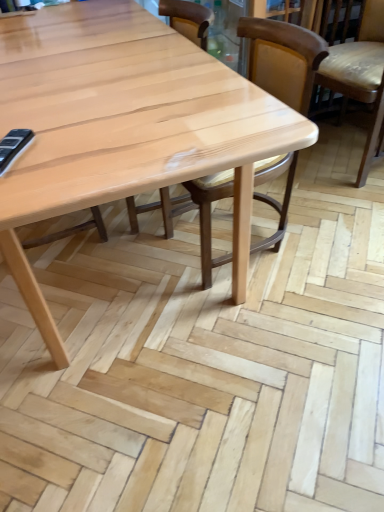
Describe the element at coordinates (361, 76) in the screenshot. Image resolution: width=384 pixels, height=512 pixels. I see `light brown leather chair at right, arranged as the first chair when viewed from the right` at that location.

Locate an element on the screen. wooden chair at center, placed as the second chair when sorted from right to left is located at coordinates (283, 59).

This screenshot has width=384, height=512. What do you see at coordinates (283, 59) in the screenshot?
I see `wooden chair at center, placed as the second chair when sorted from right to left` at bounding box center [283, 59].

At what (x,y) coordinates should I click in order to perform the action: click on light brown leather chair at right, arranged as the first chair when viewed from the right. Please return your answer as a coordinate pair (x, y). Looking at the image, I should click on (361, 76).

At what (x,y) coordinates should I click in order to perform the action: click on chair to the right of wooden chair at center, placed as the second chair when sorted from right to left. Please return your answer as a coordinate pair (x, y). Image resolution: width=384 pixels, height=512 pixels. Looking at the image, I should click on (361, 76).

Considering the sizes of light brown leather chair at right, which is the 3th chair in left-to-right order, and wooden chair at center, placed as the second chair when sorted from right to left, in the image, is light brown leather chair at right, which is the 3th chair in left-to-right order, bigger or smaller than wooden chair at center, placed as the second chair when sorted from right to left,?

light brown leather chair at right, which is the 3th chair in left-to-right order, is bigger than wooden chair at center, placed as the second chair when sorted from right to left.

Which is in front, point (379, 124) or point (293, 57)?

The point (293, 57) is in front.

Can you confirm if natural wood chair at center, which is the first chair in left-to-right order, is shorter than light brown leather chair at right, arranged as the first chair when viewed from the right?

In fact, natural wood chair at center, which is the first chair in left-to-right order, may be taller than light brown leather chair at right, arranged as the first chair when viewed from the right.

How much distance is there between natural wood chair at center, which is the first chair in left-to-right order, and light brown leather chair at right, which is the 3th chair in left-to-right order?

natural wood chair at center, which is the first chair in left-to-right order, is 38.22 inches from light brown leather chair at right, which is the 3th chair in left-to-right order.

Locate an element on the screen. The width and height of the screenshot is (384, 512). chair that is the 1st one when counting forward from the light brown leather chair at right, arranged as the first chair when viewed from the right is located at coordinates (188, 19).

Considering the sizes of objects natural wood chair at center, which is the first chair in left-to-right order, and light brown leather chair at right, arranged as the first chair when viewed from the right, in the image provided, who is wider, natural wood chair at center, which is the first chair in left-to-right order, or light brown leather chair at right, arranged as the first chair when viewed from the right,?

Wider between the two is light brown leather chair at right, arranged as the first chair when viewed from the right.

Considering the sizes of objects natural wood chair at center, which is the 3th chair in right-to-left order, and wooden chair at center, placed as the second chair when sorted from right to left, in the image provided, who is shorter, natural wood chair at center, which is the 3th chair in right-to-left order, or wooden chair at center, placed as the second chair when sorted from right to left,?

Standing shorter between the two is wooden chair at center, placed as the second chair when sorted from right to left.

Identify the location of chair below the natural wood chair at center, which is the first chair in left-to-right order (from the image's perspective). Image resolution: width=384 pixels, height=512 pixels. (283, 59).

In the scene shown: Is natural wood chair at center, which is the 3th chair in right-to-left order, not inside wooden chair at center, placed as the second chair when sorted from right to left?

Absolutely, natural wood chair at center, which is the 3th chair in right-to-left order, is external to wooden chair at center, placed as the second chair when sorted from right to left.

In terms of height, does wooden chair at center, acting as the 2th chair starting from the left, look taller or shorter compared to natural wood chair at center, which is the 3th chair in right-to-left order?

Clearly, wooden chair at center, acting as the 2th chair starting from the left, is shorter compared to natural wood chair at center, which is the 3th chair in right-to-left order.

Is wooden chair at center, placed as the second chair when sorted from right to left, oriented towards natural wood chair at center, which is the 3th chair in right-to-left order?

No, wooden chair at center, placed as the second chair when sorted from right to left, is not turned towards natural wood chair at center, which is the 3th chair in right-to-left order.

Is wooden chair at center, acting as the 2th chair starting from the left, outside of natural wood chair at center, which is the 3th chair in right-to-left order?

Yes.

Can you confirm if wooden chair at center, placed as the second chair when sorted from right to left, is wider than natural wood chair at center, which is the first chair in left-to-right order?

Yes, wooden chair at center, placed as the second chair when sorted from right to left, is wider than natural wood chair at center, which is the first chair in left-to-right order.

Are wooden chair at center, acting as the 2th chair starting from the left, and light brown leather chair at right, arranged as the first chair when viewed from the right, far apart?

No, wooden chair at center, acting as the 2th chair starting from the left, is not far away from light brown leather chair at right, arranged as the first chair when viewed from the right.

Is wooden chair at center, acting as the 2th chair starting from the left, positioned beyond the bounds of light brown leather chair at right, which is the 3th chair in left-to-right order?

Yes, wooden chair at center, acting as the 2th chair starting from the left, is not within light brown leather chair at right, which is the 3th chair in left-to-right order.

Considering the relative positions of wooden chair at center, acting as the 2th chair starting from the left, and light brown leather chair at right, which is the 3th chair in left-to-right order, in the image provided, is wooden chair at center, acting as the 2th chair starting from the left, behind light brown leather chair at right, which is the 3th chair in left-to-right order,?

No, wooden chair at center, acting as the 2th chair starting from the left, is closer to the viewer.

Is wooden chair at center, acting as the 2th chair starting from the left, positioned with its back to light brown leather chair at right, arranged as the first chair when viewed from the right?

That's right, wooden chair at center, acting as the 2th chair starting from the left, is facing away from light brown leather chair at right, arranged as the first chair when viewed from the right.

How far apart are light brown leather chair at right, arranged as the first chair when viewed from the right, and natural wood chair at center, which is the first chair in left-to-right order?

97.07 centimeters.

Relative to natural wood chair at center, which is the first chair in left-to-right order, is light brown leather chair at right, arranged as the first chair when viewed from the right, in front or behind?

Clearly, light brown leather chair at right, arranged as the first chair when viewed from the right, is behind natural wood chair at center, which is the first chair in left-to-right order.

Can you confirm if light brown leather chair at right, arranged as the first chair when viewed from the right, is bigger than natural wood chair at center, which is the first chair in left-to-right order?

Indeed, light brown leather chair at right, arranged as the first chair when viewed from the right, has a larger size compared to natural wood chair at center, which is the first chair in left-to-right order.

Does point (368, 150) come behind point (200, 11)?

That is True.

Starting from the light brown leather chair at right, which is the 3th chair in left-to-right order, which chair is the 1st one to the left? Please provide its 2D coordinates.

[(283, 59)]

Where is `chair that is the 2nd object to the right of the natural wood chair at center, which is the first chair in left-to-right order, starting at the anchor`? The width and height of the screenshot is (384, 512). chair that is the 2nd object to the right of the natural wood chair at center, which is the first chair in left-to-right order, starting at the anchor is located at coordinates (361, 76).

Looking at the image, which one is located further to natural wood chair at center, which is the 3th chair in right-to-left order, light brown leather chair at right, arranged as the first chair when viewed from the right, or wooden chair at center, placed as the second chair when sorted from right to left?

light brown leather chair at right, arranged as the first chair when viewed from the right.

From the image, which object appears to be farther from light brown leather chair at right, which is the 3th chair in left-to-right order, wooden chair at center, acting as the 2th chair starting from the left, or natural wood chair at center, which is the first chair in left-to-right order?

Among the two, natural wood chair at center, which is the first chair in left-to-right order, is located further to light brown leather chair at right, which is the 3th chair in left-to-right order.

Considering their positions, is natural wood chair at center, which is the 3th chair in right-to-left order, positioned closer to wooden chair at center, placed as the second chair when sorted from right to left, than light brown leather chair at right, arranged as the first chair when viewed from the right?

Among the two, natural wood chair at center, which is the 3th chair in right-to-left order, is located nearer to wooden chair at center, placed as the second chair when sorted from right to left.

When comparing their distances from wooden chair at center, acting as the 2th chair starting from the left, does light brown leather chair at right, which is the 3th chair in left-to-right order, or natural wood chair at center, which is the first chair in left-to-right order, seem closer?

natural wood chair at center, which is the first chair in left-to-right order.

In the scene shown: Which object lies nearer to the anchor point natural wood chair at center, which is the 3th chair in right-to-left order, wooden chair at center, acting as the 2th chair starting from the left, or light brown leather chair at right, which is the 3th chair in left-to-right order?

Based on the image, wooden chair at center, acting as the 2th chair starting from the left, appears to be nearer to natural wood chair at center, which is the 3th chair in right-to-left order.

From the image, which object appears to be nearer to light brown leather chair at right, arranged as the first chair when viewed from the right, natural wood chair at center, which is the first chair in left-to-right order, or wooden chair at center, placed as the second chair when sorted from right to left?

Based on the image, wooden chair at center, placed as the second chair when sorted from right to left, appears to be nearer to light brown leather chair at right, arranged as the first chair when viewed from the right.

You are a GUI agent. You are given a task and a screenshot of the screen. Output one action in this format:
    pyautogui.click(x=<x>, y=<y>)
    Task: Click on the chair situated between natural wood chair at center, which is the first chair in left-to-right order, and light brown leather chair at right, which is the 3th chair in left-to-right order, from left to right
    This screenshot has width=384, height=512.
    Given the screenshot: What is the action you would take?
    pyautogui.click(x=283, y=59)